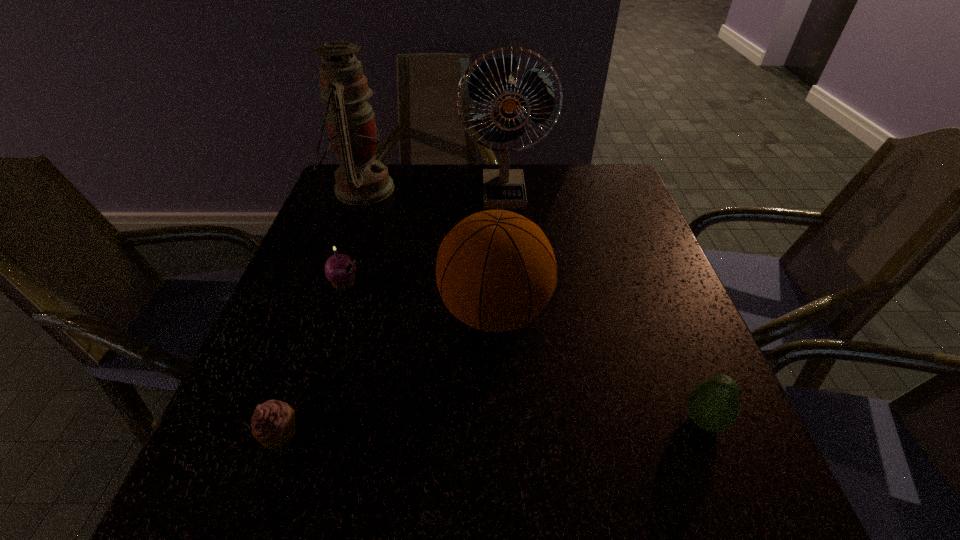
The height and width of the screenshot is (540, 960). I want to click on fan, so click(503, 188).

Where is `oil lamp`? This screenshot has width=960, height=540. oil lamp is located at coordinates (360, 180).

Where is `basketball`? basketball is located at coordinates (496, 270).

Identify the location of the rightmost object. This screenshot has height=540, width=960. (713, 404).

The width and height of the screenshot is (960, 540). I want to click on the taller cupcake, so click(340, 269).

Identify the location of the shortest object. The width and height of the screenshot is (960, 540). (273, 424).

Where is `the shorter cupcake`? The width and height of the screenshot is (960, 540). the shorter cupcake is located at coordinates (273, 424).

Identify the location of free space located on the front-facing side of the fan. click(x=507, y=234).

At what (x,y) coordinates should I click in order to perform the action: click on free space located 0.110m on the right of the oil lamp. Please return your answer as a coordinate pair (x, y). This screenshot has width=960, height=540. Looking at the image, I should click on (433, 190).

You are a GUI agent. You are given a task and a screenshot of the screen. Output one action in this format:
    pyautogui.click(x=<x>, y=<y>)
    Task: Click on the vacant space located on the front of the basketball
    The width and height of the screenshot is (960, 540).
    Given the screenshot: What is the action you would take?
    pyautogui.click(x=497, y=400)